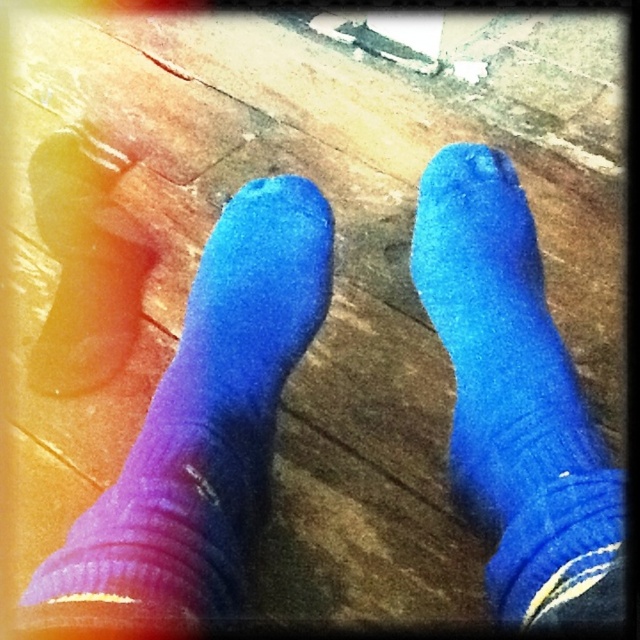
Question: Is purple matte socks at lower left behind purple matte sock at lower left?

Choices:
 (A) yes
 (B) no

Answer: (B)

Question: Is purple matte socks at lower left closer to the viewer compared to purple matte sock at lower left?

Choices:
 (A) no
 (B) yes

Answer: (B)

Question: Which object is the closest to the purple matte sock at lower left?

Choices:
 (A) purple matte socks at lower left
 (B) blue fuzzy sock at center

Answer: (A)

Question: Can you confirm if purple matte socks at lower left is thinner than purple matte sock at lower left?

Choices:
 (A) yes
 (B) no

Answer: (B)

Question: Which is farther from the purple matte sock at lower left?

Choices:
 (A) purple matte socks at lower left
 (B) blue fuzzy sock at center

Answer: (B)

Question: Which of the following is the closest to the observer?

Choices:
 (A) purple matte sock at lower left
 (B) blue fuzzy sock at center
 (C) purple matte socks at lower left

Answer: (C)